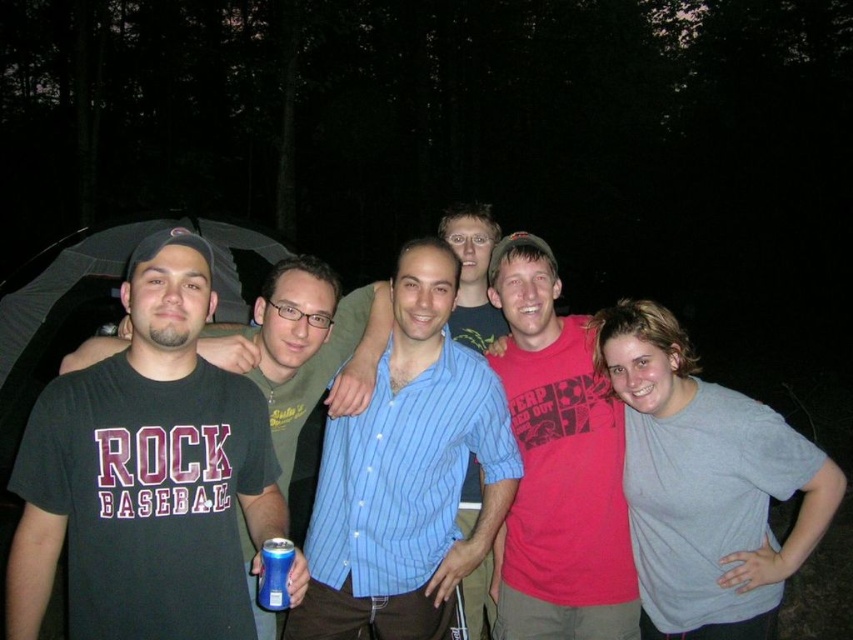
Question: Is dark gray t-shirt at left above blue plastic can at lower left?

Choices:
 (A) no
 (B) yes

Answer: (B)

Question: From the image, what is the correct spatial relationship of blue striped shirt at center in relation to matte red shirt at center?

Choices:
 (A) left
 (B) right

Answer: (A)

Question: Among these points, which one is farthest from the camera?

Choices:
 (A) [x=349, y=627]
 (B) [x=259, y=596]

Answer: (A)

Question: Which object is positioned closest to the blue striped shirt at center?

Choices:
 (A) blue plastic can at lower left
 (B) dark gray t-shirt at left
 (C) matte red shirt at center

Answer: (C)

Question: Is blue striped shirt at center below blue plastic can at lower left?

Choices:
 (A) no
 (B) yes

Answer: (A)

Question: Estimate the real-world distances between objects in this image. Which object is closer to the blue striped shirt at center?

Choices:
 (A) dark gray t-shirt at left
 (B) matte red shirt at center

Answer: (B)